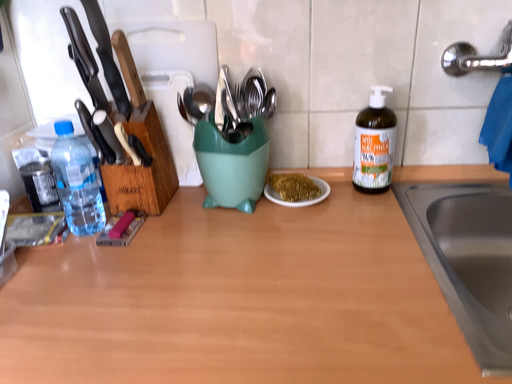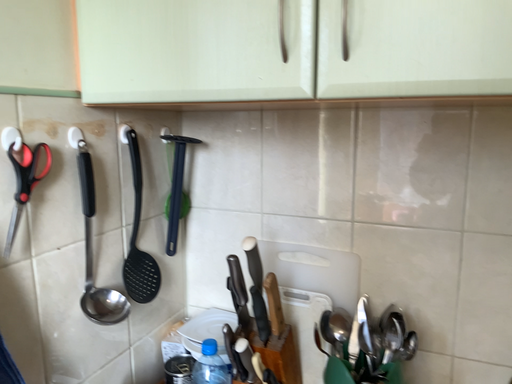
Question: How did the camera likely rotate when shooting the video?

Choices:
 (A) rotated left
 (B) rotated right

Answer: (A)